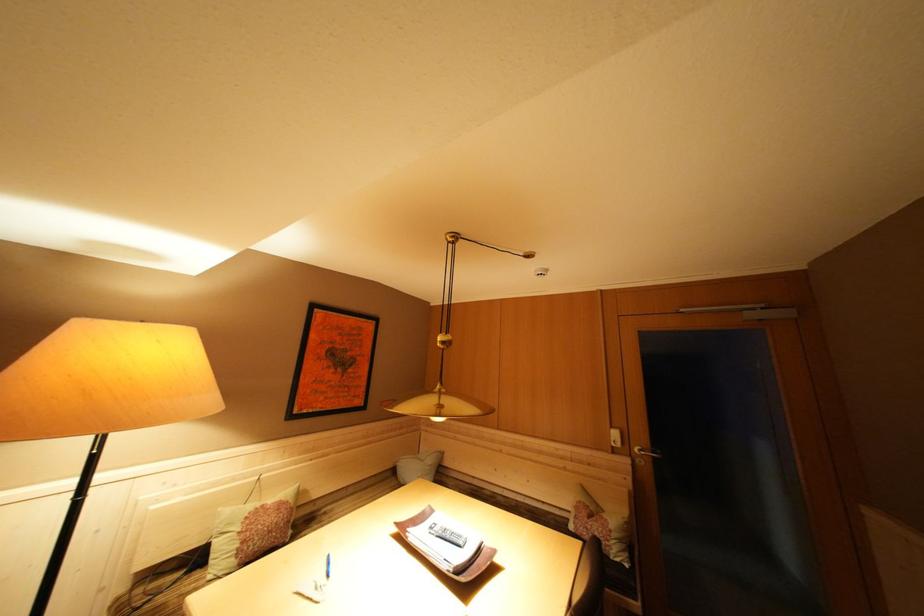
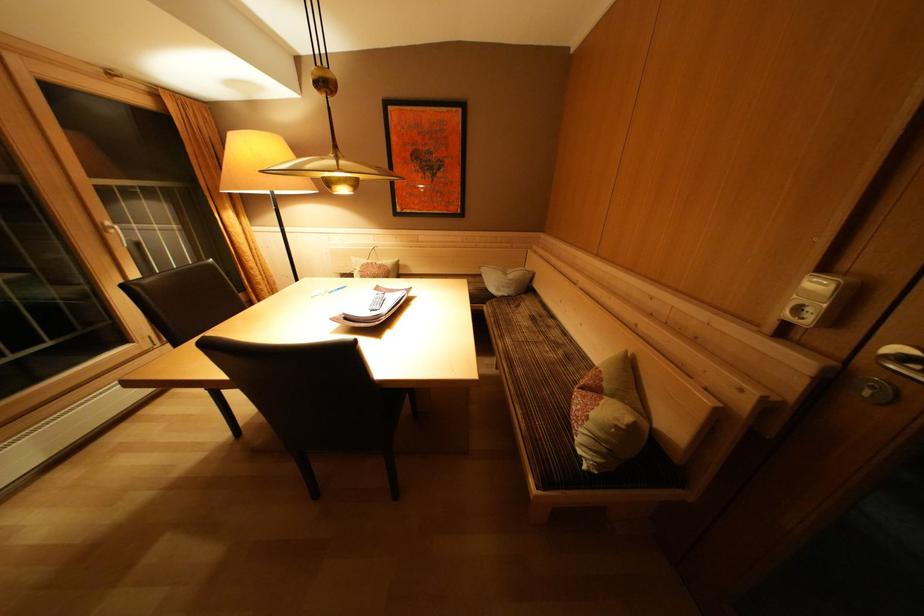
Where in the second image is the point corresponding to pixel 438 466 from the first image?

(517, 281)